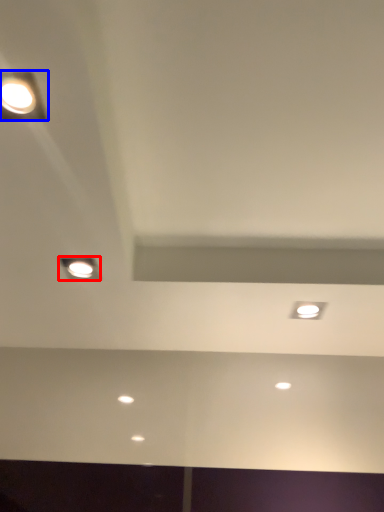
Question: Which point is further to the camera, lamp (highlighted by a red box) or lamp (highlighted by a blue box)?

Choices:
 (A) lamp
 (B) lamp

Answer: (A)